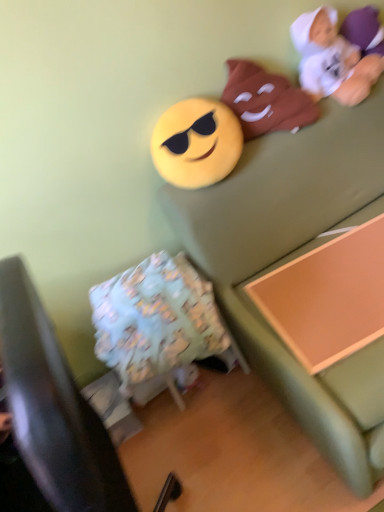
Question: Should I look upward or downward to see fluffy fabric pillow at lower left?

Choices:
 (A) up
 (B) down

Answer: (B)

Question: From the image's perspective, does yellow matte emoji at upper center, which is the 1th toy from left to right, appear higher than matte brown plush at upper right, the 2th toy in the right-to-left sequence?

Choices:
 (A) yes
 (B) no

Answer: (B)

Question: From a real-world perspective, is yellow matte emoji at upper center, which appears as the third toy when viewed from the right, under matte brown plush at upper right, the 2th toy in the right-to-left sequence?

Choices:
 (A) yes
 (B) no

Answer: (A)

Question: Is yellow matte emoji at upper center, which is the 1th toy from left to right, taller than matte brown plush at upper right, marked as the 2th toy in a left-to-right arrangement?

Choices:
 (A) no
 (B) yes

Answer: (A)

Question: From a real-world perspective, is yellow matte emoji at upper center, which appears as the third toy when viewed from the right, on matte brown plush at upper right, marked as the 2th toy in a left-to-right arrangement?

Choices:
 (A) no
 (B) yes

Answer: (A)

Question: Is yellow matte emoji at upper center, which is the 1th toy from left to right, touching matte brown plush at upper right, the 2th toy in the right-to-left sequence?

Choices:
 (A) yes
 (B) no

Answer: (B)

Question: Is yellow matte emoji at upper center, which is the 1th toy from left to right, far from matte brown plush at upper right, marked as the 2th toy in a left-to-right arrangement?

Choices:
 (A) yes
 (B) no

Answer: (B)

Question: Considering the relative sizes of light blue fabric bean bag chair at lower left and yellow matte emoji at upper center, which is the 1th toy from left to right, in the image provided, is light blue fabric bean bag chair at lower left shorter than yellow matte emoji at upper center, which is the 1th toy from left to right,?

Choices:
 (A) no
 (B) yes

Answer: (A)

Question: Is the depth of light blue fabric bean bag chair at lower left greater than that of yellow matte emoji at upper center, which is the 1th toy from left to right?

Choices:
 (A) no
 (B) yes

Answer: (B)

Question: From a real-world perspective, is light blue fabric bean bag chair at lower left physically above yellow matte emoji at upper center, which appears as the third toy when viewed from the right?

Choices:
 (A) yes
 (B) no

Answer: (B)

Question: Can you confirm if light blue fabric bean bag chair at lower left is positioned to the left of yellow matte emoji at upper center, which is the 1th toy from left to right?

Choices:
 (A) yes
 (B) no

Answer: (A)

Question: From the image's perspective, would you say light blue fabric bean bag chair at lower left is positioned over yellow matte emoji at upper center, which is the 1th toy from left to right?

Choices:
 (A) yes
 (B) no

Answer: (B)

Question: From a real-world perspective, is light blue fabric bean bag chair at lower left positioned under yellow matte emoji at upper center, which is the 1th toy from left to right, based on gravity?

Choices:
 (A) no
 (B) yes

Answer: (B)

Question: Is fluffy fabric pillow at lower left to the right of orange wood changing table at lower right from the viewer's perspective?

Choices:
 (A) yes
 (B) no

Answer: (B)